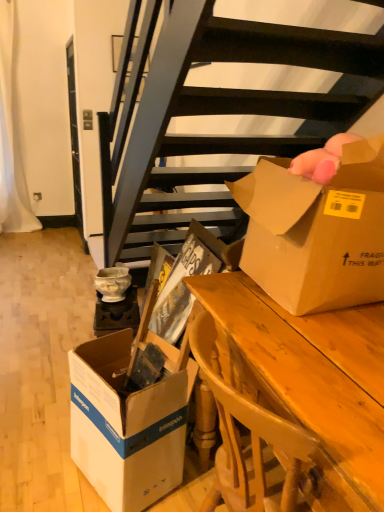
Question: Is cardboard box at center at the left side of wooden desk at center?

Choices:
 (A) no
 (B) yes

Answer: (B)

Question: Can you confirm if cardboard box at center is taller than wooden desk at center?

Choices:
 (A) no
 (B) yes

Answer: (B)

Question: Is cardboard box at center completely or partially outside of wooden desk at center?

Choices:
 (A) yes
 (B) no

Answer: (A)

Question: Could you tell me if cardboard box at center is turned towards wooden desk at center?

Choices:
 (A) yes
 (B) no

Answer: (B)

Question: Could wooden desk at center be considered to be inside cardboard box at center?

Choices:
 (A) no
 (B) yes

Answer: (A)

Question: In terms of size, does wooden desk at center appear bigger or smaller than cardboard box at center?

Choices:
 (A) big
 (B) small

Answer: (A)

Question: In terms of width, does wooden desk at center look wider or thinner when compared to cardboard box at center?

Choices:
 (A) thin
 (B) wide

Answer: (B)

Question: Does point (339, 443) appear closer or farther from the camera than point (150, 303)?

Choices:
 (A) closer
 (B) farther

Answer: (A)

Question: Is wooden desk at center to the left or to the right of cardboard box at center in the image?

Choices:
 (A) right
 (B) left

Answer: (A)

Question: Which is correct: cardboard box at center is inside brown cardboard box at upper right, the 1th box when ordered from top to bottom, or outside of it?

Choices:
 (A) outside
 (B) inside

Answer: (A)

Question: Is point (170, 431) closer or farther from the camera than point (291, 287)?

Choices:
 (A) closer
 (B) farther

Answer: (B)

Question: Is cardboard box at center bigger or smaller than brown cardboard box at upper right, the second box in the left-to-right sequence?

Choices:
 (A) big
 (B) small

Answer: (A)

Question: In the image, is cardboard box at center on the left side or the right side of brown cardboard box at upper right, the 2th box from the bottom?

Choices:
 (A) right
 (B) left

Answer: (B)

Question: From the image's perspective, is cardboard box at center positioned above or below white cardboard box at lower left, positioned as the 1th box in bottom-to-top order?

Choices:
 (A) below
 (B) above

Answer: (B)

Question: Would you say cardboard box at center is to the left or to the right of white cardboard box at lower left, positioned as the 2th box in top-to-bottom order, in the picture?

Choices:
 (A) right
 (B) left

Answer: (A)